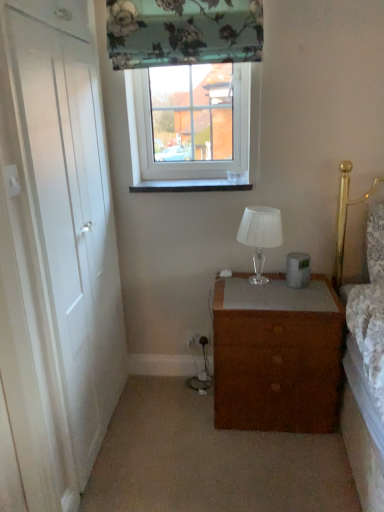
Question: Is floral fabric curtain at upper center to the left of brown matte chest of drawers at center from the viewer's perspective?

Choices:
 (A) no
 (B) yes

Answer: (B)

Question: Can you confirm if floral fabric curtain at upper center is bigger than brown matte chest of drawers at center?

Choices:
 (A) no
 (B) yes

Answer: (A)

Question: Does floral fabric curtain at upper center lie in front of brown matte chest of drawers at center?

Choices:
 (A) no
 (B) yes

Answer: (B)

Question: Is floral fabric curtain at upper center located outside brown matte chest of drawers at center?

Choices:
 (A) yes
 (B) no

Answer: (A)

Question: Is floral fabric curtain at upper center not near brown matte chest of drawers at center?

Choices:
 (A) no
 (B) yes

Answer: (B)

Question: Considering the positions of white glossy window sill at center and clear glass window at upper center in the image, is white glossy window sill at center wider or thinner than clear glass window at upper center?

Choices:
 (A) wide
 (B) thin

Answer: (A)

Question: In terms of size, does white glossy window sill at center appear bigger or smaller than clear glass window at upper center?

Choices:
 (A) big
 (B) small

Answer: (B)

Question: From a real-world perspective, is white glossy window sill at center physically located above or below clear glass window at upper center?

Choices:
 (A) above
 (B) below

Answer: (B)

Question: From the image's perspective, is white glossy window sill at center located above or below clear glass window at upper center?

Choices:
 (A) below
 (B) above

Answer: (A)

Question: Is brown matte chest of drawers at center to the left or to the right of white glass lamp at center in the image?

Choices:
 (A) left
 (B) right

Answer: (B)

Question: Considering the positions of point tap(216, 312) and point tap(266, 234), is point tap(216, 312) closer or farther from the camera than point tap(266, 234)?

Choices:
 (A) closer
 (B) farther

Answer: (A)

Question: From the image's perspective, is brown matte chest of drawers at center positioned above or below white glass lamp at center?

Choices:
 (A) above
 (B) below

Answer: (B)

Question: In terms of width, does brown matte chest of drawers at center look wider or thinner when compared to white glass lamp at center?

Choices:
 (A) thin
 (B) wide

Answer: (B)

Question: From a real-world perspective, is floral fabric curtain at upper center physically located above or below white wooden door at left?

Choices:
 (A) above
 (B) below

Answer: (A)

Question: From the image's perspective, relative to white wooden door at left, is floral fabric curtain at upper center above or below?

Choices:
 (A) below
 (B) above

Answer: (B)